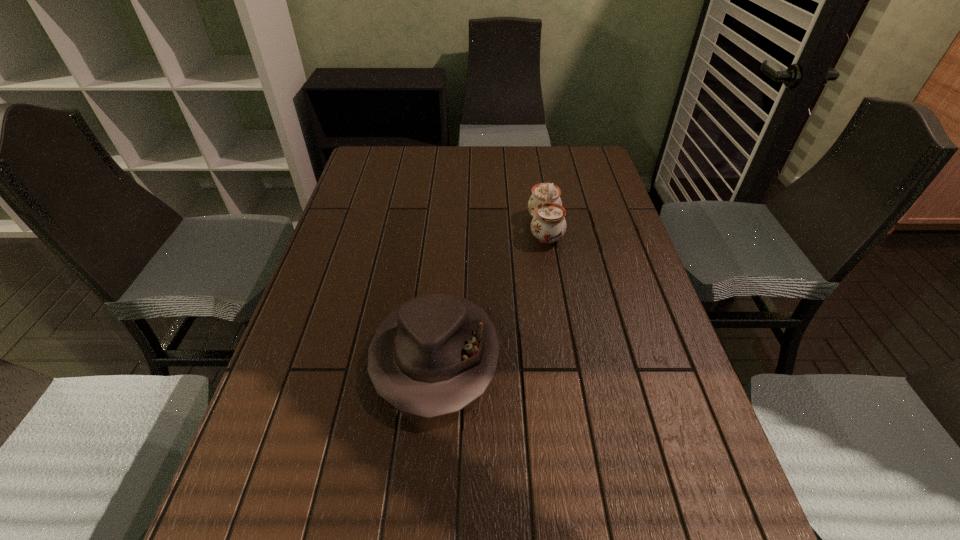
Identify the location of the farther object. This screenshot has width=960, height=540. (548, 225).

This screenshot has height=540, width=960. Find the location of `chinaware`. chinaware is located at coordinates (548, 225).

This screenshot has height=540, width=960. Identify the location of hat. (433, 355).

Locate an element on the screen. the left object is located at coordinates (433, 355).

The image size is (960, 540). I want to click on vacant space located by the handle of the right object, so click(474, 228).

Identify the location of vacant space located 0.200m by the handle of the right object. (462, 228).

The image size is (960, 540). What are the coordinates of `vacant region located by the handle of the right object` in the screenshot? It's located at pyautogui.click(x=455, y=228).

The height and width of the screenshot is (540, 960). I want to click on free location located 0.110m on the decorative side of the shorter object, so click(424, 484).

Find the location of a particular element. This screenshot has height=540, width=960. blank space at the far edge of the desktop is located at coordinates (441, 174).

In the image, there is a desktop. Where is `blank space at the left edge`? blank space at the left edge is located at coordinates (310, 438).